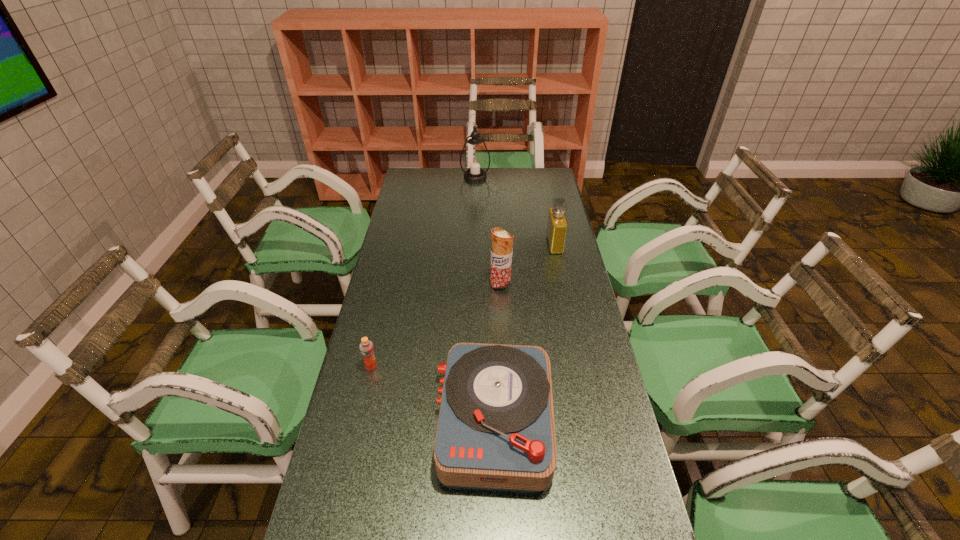
This screenshot has width=960, height=540. Identify the location of free space between the third shortest object and the leftmost object. (463, 306).

Find the location of a particular element. The image size is (960, 540). the third closest object to the leftmost object is located at coordinates (557, 225).

Select which object is the second closest to the tallest object. Please provide its 2D coordinates. Your answer should be formatted as a tuple, i.e. [(x, y)], where the tuple contains the x and y coordinates of a point satisfying the conditions above.

[(502, 241)]

The width and height of the screenshot is (960, 540). Find the location of `vacant space that satisfies the following two spatial constraints: 1. on the front side of the farthest object; 2. on the left side of the fourth shortest object`. vacant space that satisfies the following two spatial constraints: 1. on the front side of the farthest object; 2. on the left side of the fourth shortest object is located at coordinates pyautogui.click(x=473, y=285).